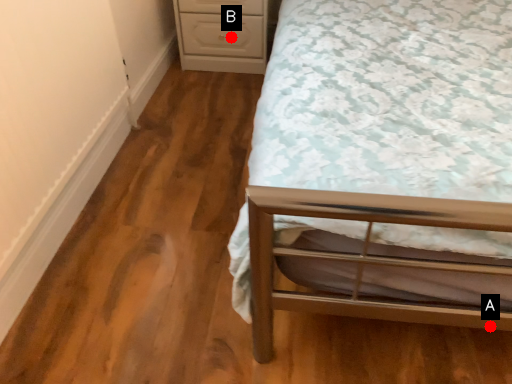
Question: Two points are circled on the image, labeled by A and B beside each circle. Which point is farther to the camera?

Choices:
 (A) A is further
 (B) B is further

Answer: (B)